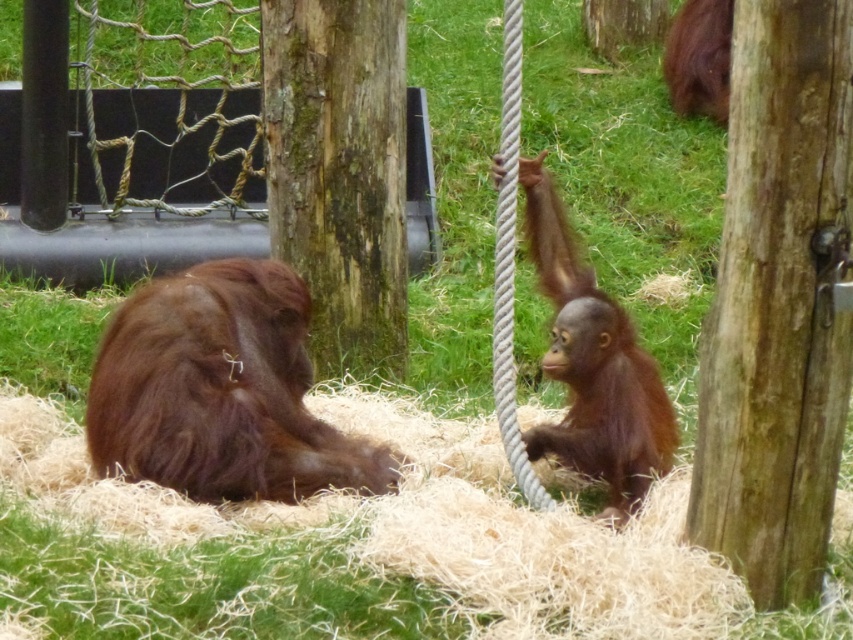
Question: Can you confirm if green mossy wood at center is positioned above brown rough tree trunk at upper center?

Choices:
 (A) no
 (B) yes

Answer: (A)

Question: Does brown furry orangutan at right come in front of brown rough tree trunk at upper center?

Choices:
 (A) no
 (B) yes

Answer: (B)

Question: Is wooden post at center below brown furry orangutan at right?

Choices:
 (A) yes
 (B) no

Answer: (B)

Question: Which of the following is the farthest from the observer?

Choices:
 (A) brown furry orangutan at left
 (B) brown rough tree trunk at upper center

Answer: (B)

Question: Which object is the closest to the brown rough tree trunk at upper center?

Choices:
 (A) brown furry orangutan at right
 (B) brown furry orangutan at left

Answer: (A)

Question: Considering the real-world distances, which object is farthest from the brown rough tree trunk at upper center?

Choices:
 (A) wooden post at center
 (B) green mossy wood at center

Answer: (A)